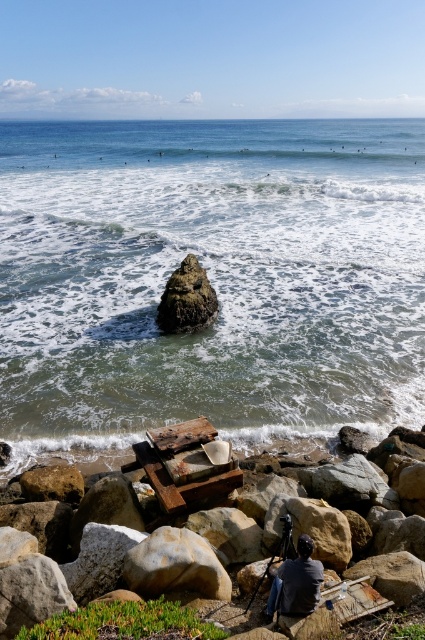
Question: Which point is closer to the camera taking this photo?

Choices:
 (A) tap(306, 540)
 (B) tap(170, 588)
 (C) tap(302, 323)
 (D) tap(158, 324)

Answer: (A)

Question: Is rusty wood picnic table at center bigger than dark gray fabric at center?

Choices:
 (A) yes
 (B) no

Answer: (A)

Question: Which object is farther from the camera taking this photo?

Choices:
 (A) dark gray fabric at center
 (B) speckled beige rock at center

Answer: (B)

Question: Is rusty wood picnic table at center wider than rusty metal rock at center?

Choices:
 (A) yes
 (B) no

Answer: (B)

Question: Estimate the real-world distances between objects in this image. Which object is farther from the dark gray fabric at center?

Choices:
 (A) rusty wood picnic table at center
 (B) greenish water at center
 (C) rusty metal rock at center

Answer: (B)

Question: Observing the image, what is the correct spatial positioning of speckled beige rock at center in reference to dark gray fabric at center?

Choices:
 (A) left
 (B) right

Answer: (A)